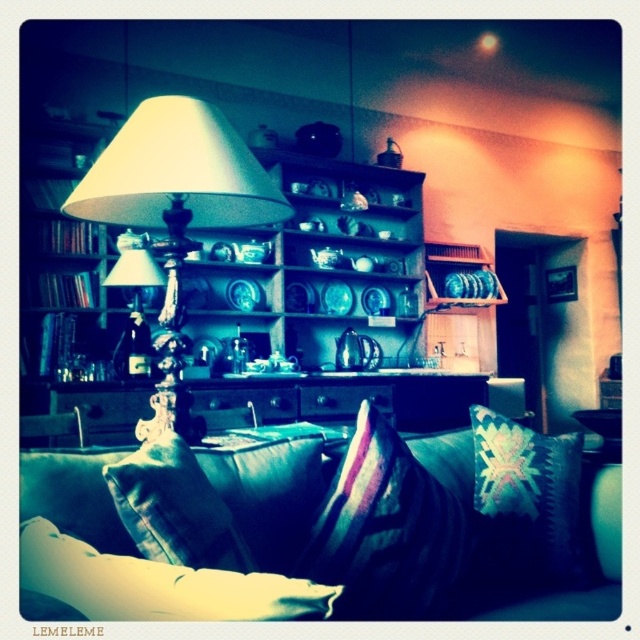
Is velvet striped pillow at center above velvet green pillow at lower center?

Actually, velvet striped pillow at center is below velvet green pillow at lower center.

At what (x,y) coordinates should I click in order to perform the action: click on velvet striped pillow at center. Please return your answer as a coordinate pair (x, y). This screenshot has height=640, width=640. Looking at the image, I should click on (387, 531).

Who is taller, velvet cushion at lower left or knitted woolen pillow at center?

knitted woolen pillow at center

Identify the location of velvet cushion at lower left. (157, 584).

Can you confirm if velvet cushion at lower left is taller than velvet green armchair at lower left?

In fact, velvet cushion at lower left may be shorter than velvet green armchair at lower left.

Is point (260, 611) closer to viewer compared to point (65, 419)?

Yes, it is.

This screenshot has height=640, width=640. What are the coordinates of `velvet cushion at lower left` in the screenshot? It's located at (157, 584).

The width and height of the screenshot is (640, 640). In order to click on velvet cushion at lower left in this screenshot , I will do `click(157, 584)`.